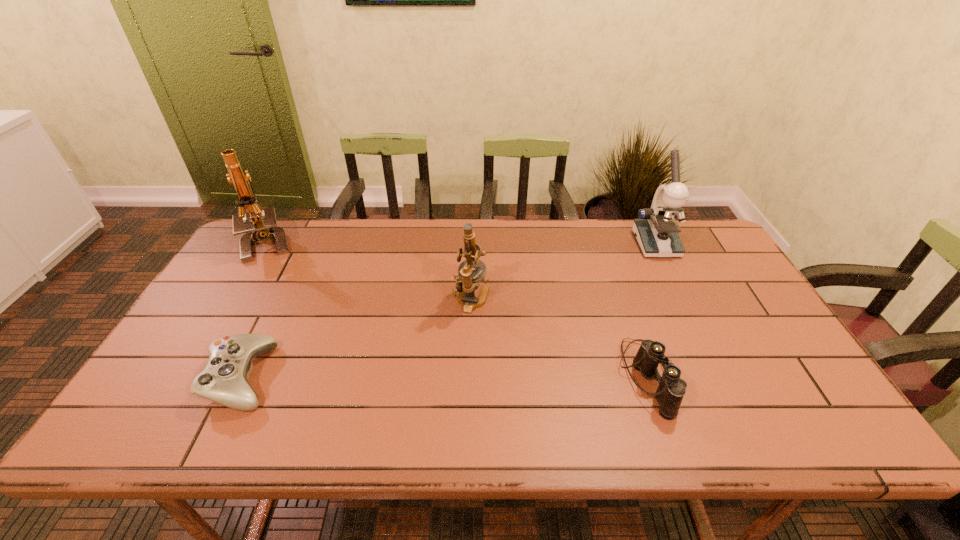
I want to click on vacant space situated on the right of the fourth tallest object, so click(x=779, y=377).

Image resolution: width=960 pixels, height=540 pixels. I want to click on free location located on the right of the shortest object, so click(x=327, y=377).

At what (x,y) coordinates should I click in order to perform the action: click on binoculars that is at the near edge. Please return your answer as a coordinate pair (x, y). The height and width of the screenshot is (540, 960). Looking at the image, I should click on (671, 389).

The image size is (960, 540). I want to click on control that is at the near edge, so click(224, 380).

Identify the location of microscope that is at the left edge. The width and height of the screenshot is (960, 540). (x=264, y=226).

The width and height of the screenshot is (960, 540). Identify the location of control that is at the left edge. (224, 380).

At what (x,y) coordinates should I click in order to perform the action: click on object located in the right edge section of the desktop. Please return your answer as a coordinate pair (x, y). The height and width of the screenshot is (540, 960). Looking at the image, I should click on (656, 230).

Locate an element on the screen. The width and height of the screenshot is (960, 540). object that is at the far left corner is located at coordinates (264, 226).

At what (x,y) coordinates should I click in order to perform the action: click on object present at the near left corner. Please return your answer as a coordinate pair (x, y). The image size is (960, 540). Looking at the image, I should click on (224, 380).

Locate an element on the screen. The height and width of the screenshot is (540, 960). object positioned at the far right corner is located at coordinates (656, 230).